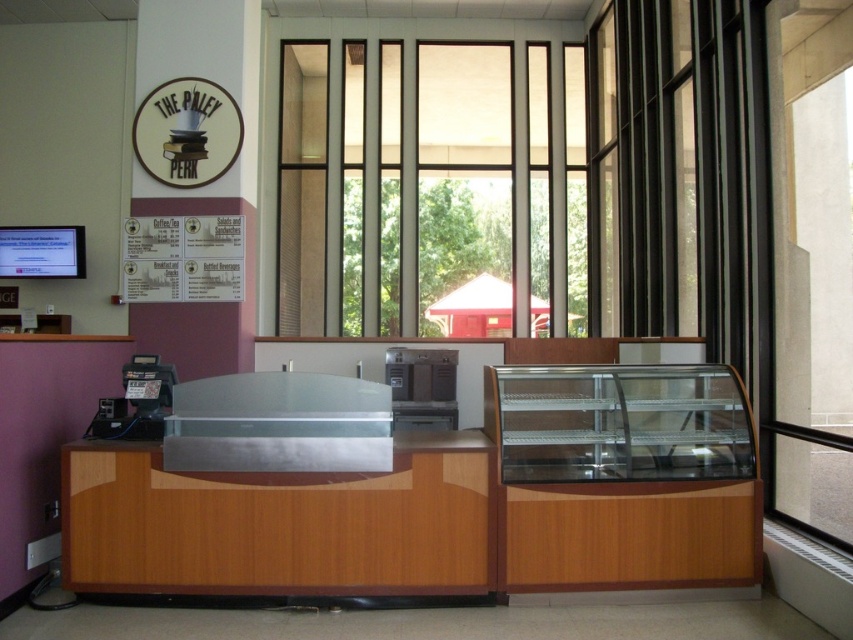
Question: Considering the real-world distances, which object is farthest from the transparent glass window at center?

Choices:
 (A) matte brown sign at upper center
 (B) wooden/polisheddesk at center
 (C) wooden display case at right

Answer: (B)

Question: Does transparent glass window at center have a larger size compared to wooden/polisheddesk at center?

Choices:
 (A) yes
 (B) no

Answer: (A)

Question: Among these points, which one is nearest to the camera?

Choices:
 (A) (177, 182)
 (B) (480, 490)

Answer: (B)

Question: Does wooden display case at right have a smaller size compared to matte brown sign at upper center?

Choices:
 (A) yes
 (B) no

Answer: (B)

Question: Which point is farther to the camera?

Choices:
 (A) (347, 220)
 (B) (607, 452)

Answer: (A)

Question: In this image, where is transparent glass window at center located relative to wooden/polisheddesk at center?

Choices:
 (A) left
 (B) right

Answer: (B)